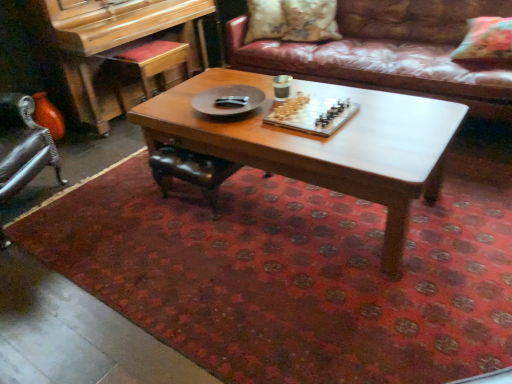
Identify the location of empty space that is to the right of translucent glass chessboard at center. (385, 116).